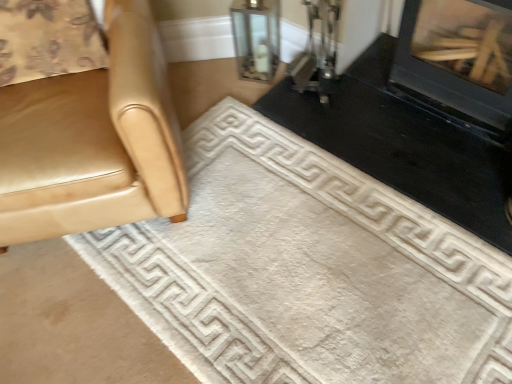
Question: Is black glossy fireplace at upper right, the 2th fireplace in the right-to-left sequence, directly adjacent to white soft rug at center?

Choices:
 (A) yes
 (B) no

Answer: (B)

Question: Can you confirm if black glossy fireplace at upper right, marked as the 1th fireplace in a left-to-right arrangement, is smaller than white soft rug at center?

Choices:
 (A) yes
 (B) no

Answer: (A)

Question: Can you confirm if black glossy fireplace at upper right, the 2th fireplace in the right-to-left sequence, is thinner than white soft rug at center?

Choices:
 (A) no
 (B) yes

Answer: (B)

Question: Is black glossy fireplace at upper right, marked as the 1th fireplace in a left-to-right arrangement, positioned with its back to white soft rug at center?

Choices:
 (A) yes
 (B) no

Answer: (B)

Question: Is black glossy fireplace at upper right, marked as the 1th fireplace in a left-to-right arrangement, closer to the viewer compared to white soft rug at center?

Choices:
 (A) no
 (B) yes

Answer: (A)

Question: Is black glossy fireplace at upper right, marked as the 1th fireplace in a left-to-right arrangement, positioned behind white soft rug at center?

Choices:
 (A) yes
 (B) no

Answer: (A)

Question: Could you tell me if black glass fireplace at upper right, the first fireplace from the right, is facing matte gold chair at left?

Choices:
 (A) yes
 (B) no

Answer: (B)

Question: Is black glass fireplace at upper right, the second fireplace positioned from the left, to the right of matte gold chair at left from the viewer's perspective?

Choices:
 (A) yes
 (B) no

Answer: (A)

Question: Considering the relative sizes of black glass fireplace at upper right, the first fireplace from the right, and matte gold chair at left in the image provided, is black glass fireplace at upper right, the first fireplace from the right, taller than matte gold chair at left?

Choices:
 (A) yes
 (B) no

Answer: (B)

Question: Is black glass fireplace at upper right, the second fireplace positioned from the left, at the left side of matte gold chair at left?

Choices:
 (A) no
 (B) yes

Answer: (A)

Question: Can you confirm if black glass fireplace at upper right, the first fireplace from the right, is shorter than matte gold chair at left?

Choices:
 (A) yes
 (B) no

Answer: (A)

Question: Does black glass fireplace at upper right, the second fireplace positioned from the left, come in front of matte gold chair at left?

Choices:
 (A) no
 (B) yes

Answer: (A)

Question: Is black glossy fireplace at upper right, the 2th fireplace in the right-to-left sequence, at the back of clear glass vase at upper center?

Choices:
 (A) no
 (B) yes

Answer: (A)